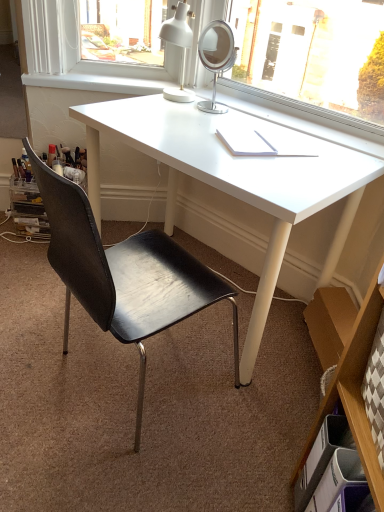
Question: From the image's perspective, would you say white glossy desk at center is positioned over black leather chair at center?

Choices:
 (A) yes
 (B) no

Answer: (A)

Question: Is black leather chair at center a part of white glossy desk at center?

Choices:
 (A) yes
 (B) no

Answer: (B)

Question: From a real-world perspective, does white glossy desk at center stand above black leather chair at center?

Choices:
 (A) yes
 (B) no

Answer: (B)

Question: Can you confirm if white glossy desk at center is shorter than black leather chair at center?

Choices:
 (A) no
 (B) yes

Answer: (B)

Question: Can you confirm if white glossy desk at center is wider than black leather chair at center?

Choices:
 (A) yes
 (B) no

Answer: (A)

Question: In terms of height, does white glossy desk at center look taller or shorter compared to brown cardboard bookshelf at lower right?

Choices:
 (A) short
 (B) tall

Answer: (A)

Question: Visually, is white glossy desk at center positioned to the left or to the right of brown cardboard bookshelf at lower right?

Choices:
 (A) left
 (B) right

Answer: (A)

Question: From the image's perspective, is white glossy desk at center above or below brown cardboard bookshelf at lower right?

Choices:
 (A) below
 (B) above

Answer: (B)

Question: Is white glossy desk at center inside the boundaries of brown cardboard bookshelf at lower right, or outside?

Choices:
 (A) inside
 (B) outside

Answer: (B)

Question: Visually, is white smooth window sill at upper center positioned to the left or to the right of white plastic drawer at lower right?

Choices:
 (A) right
 (B) left

Answer: (B)

Question: Looking at the image, does white smooth window sill at upper center seem bigger or smaller compared to white plastic drawer at lower right?

Choices:
 (A) big
 (B) small

Answer: (A)

Question: Is white smooth window sill at upper center spatially inside white plastic drawer at lower right, or outside of it?

Choices:
 (A) inside
 (B) outside

Answer: (B)

Question: Is point (84, 78) positioned closer to the camera than point (354, 468)?

Choices:
 (A) closer
 (B) farther

Answer: (B)

Question: Is white plastic drawer at lower right to the left or to the right of black leather chair at center in the image?

Choices:
 (A) right
 (B) left

Answer: (A)

Question: From the image's perspective, relative to black leather chair at center, is white plastic drawer at lower right above or below?

Choices:
 (A) below
 (B) above

Answer: (A)